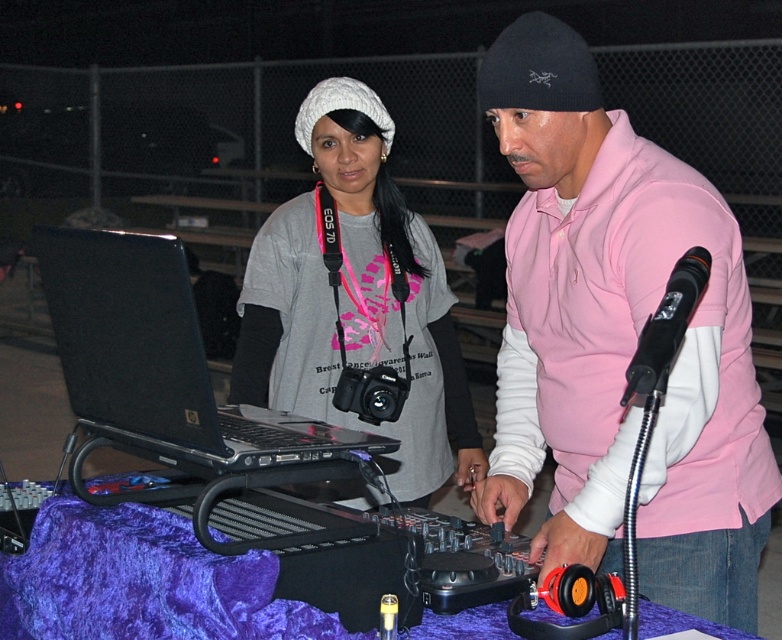
This screenshot has height=640, width=782. What do you see at coordinates (357, 300) in the screenshot? I see `matte gray shirt at center` at bounding box center [357, 300].

Consider the image. Is the position of matte gray shirt at center less distant than that of black matte microphone at upper right?

No, it is behind black matte microphone at upper right.

What are the coordinates of `matte gray shirt at center` in the screenshot? It's located at (357, 300).

Can you confirm if purple velvet table at center is positioned to the right of black matte microphone at upper right?

In fact, purple velvet table at center is to the left of black matte microphone at upper right.

Does purple velvet table at center appear over black matte microphone at upper right?

No.

The image size is (782, 640). Describe the element at coordinates (142, 582) in the screenshot. I see `purple velvet table at center` at that location.

Locate an element on the screen. This screenshot has width=782, height=640. purple velvet table at center is located at coordinates (142, 582).

Between black plastic laptop at left and purple velvet table at center, which one appears on the left side from the viewer's perspective?

Positioned to the left is black plastic laptop at left.

Where is `black plastic laptop at left`? black plastic laptop at left is located at coordinates (160, 358).